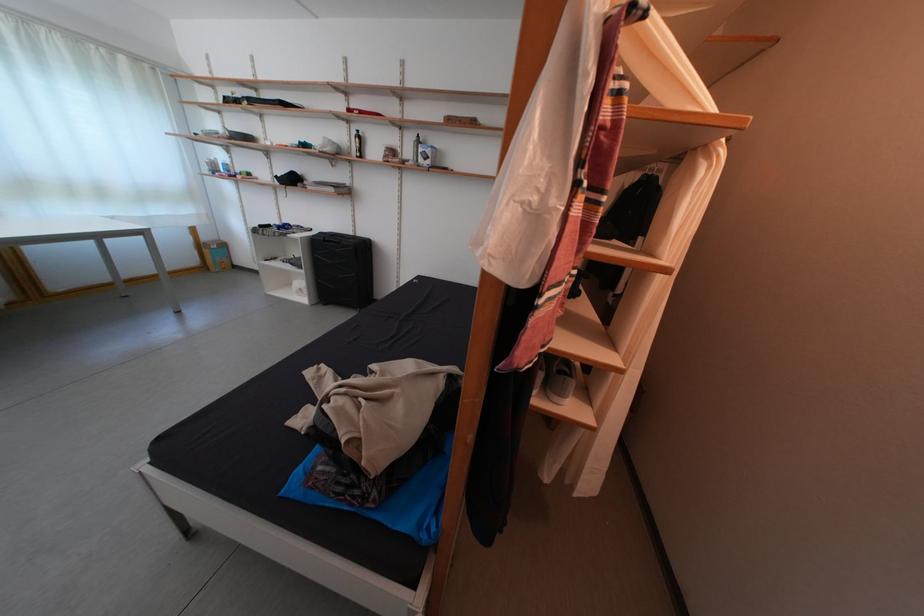
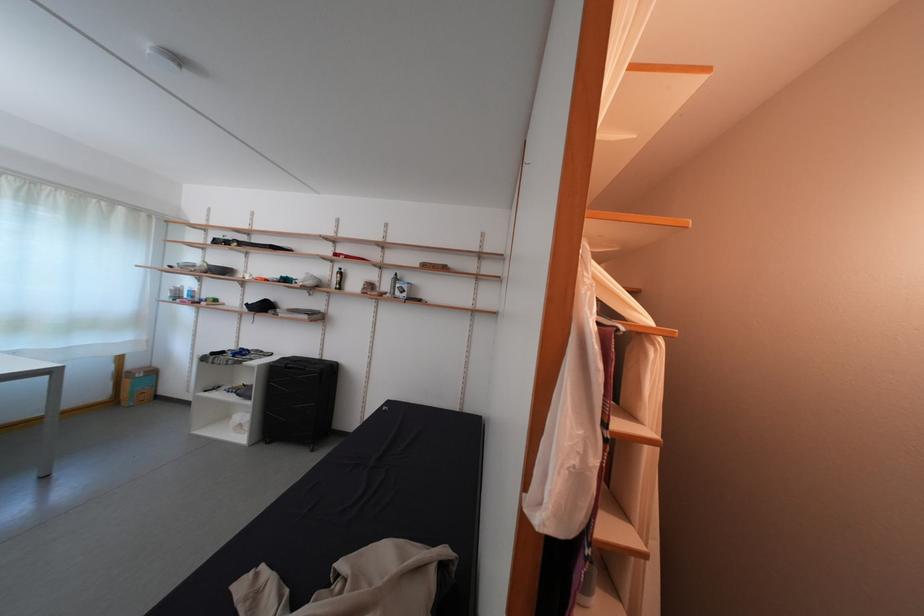
Question: How did the camera likely rotate?

Choices:
 (A) Left
 (B) Right
 (C) Up
 (D) Down

Answer: (C)